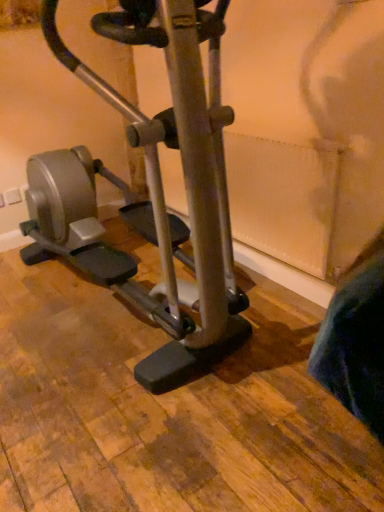
Describe the element at coordinates (152, 189) in the screenshot. The image size is (384, 512). I see `silver metallic stationary bicycle at center` at that location.

You are a GUI agent. You are given a task and a screenshot of the screen. Output one action in this format:
    pyautogui.click(x=<x>, y=<y>)
    Task: Click on the silver metallic stationary bicycle at center
    
    Given the screenshot: What is the action you would take?
    pyautogui.click(x=152, y=189)

Where is `silver metallic stationary bicycle at center`? The image size is (384, 512). silver metallic stationary bicycle at center is located at coordinates (152, 189).